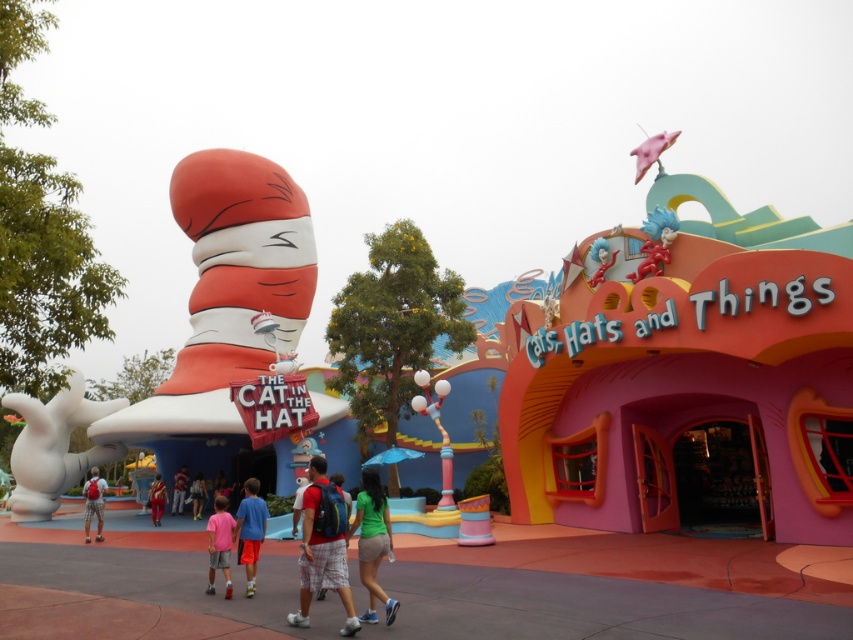
Question: Can you confirm if matte gray shorts at center is positioned to the left of light blue denim shorts at center?

Choices:
 (A) yes
 (B) no

Answer: (A)

Question: Is light blue denim shorts at center thinner than pink fabric shorts at center?

Choices:
 (A) yes
 (B) no

Answer: (A)

Question: Which point is farther from the camera taking this photo?

Choices:
 (A) (196, 513)
 (B) (335, 580)
 (C) (367, 525)
 (D) (218, 536)

Answer: (A)

Question: Which object is the farthest from the light blue denim shorts at center?

Choices:
 (A) pink fabric shorts at center
 (B) orange fabric pants at center
 (C) matte red shorts at center

Answer: (C)

Question: Can you confirm if blue fabric shorts at center is smaller than matte gray shorts at center?

Choices:
 (A) no
 (B) yes

Answer: (B)

Question: Which point is farther to the camera?

Choices:
 (A) matte gray shorts at center
 (B) blue fabric shorts at center
 (C) pink fabric shorts at lower center
 (D) green matte shorts at center

Answer: (A)